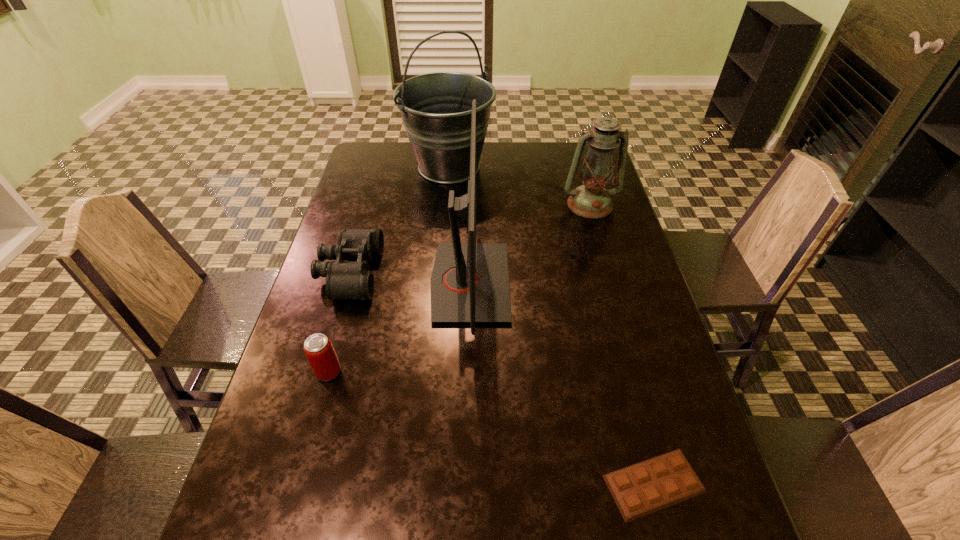
Identify which object is the nearest to the bucket. Please provide its 2D coordinates. Your answer should be formatted as a tuple, i.e. [(x, y)], where the tuple contains the x and y coordinates of a point satisfying the conditions above.

[(470, 281)]

This screenshot has height=540, width=960. Find the location of `object that is the closest to the third tallest object`. object that is the closest to the third tallest object is located at coordinates (470, 281).

Identify the location of vacant space that satisfies the following two spatial constraints: 1. on the front side of the oil lamp; 2. at the eyepieces of the second shortest object. (610, 273).

Find the location of a particular element. vacant space that satisfies the following two spatial constraints: 1. at the eyepieces of the beer can; 2. on the right side of the fifth tallest object is located at coordinates (322, 372).

Identify the location of free point that satisfies the following two spatial constraints: 1. on the front side of the oil lamp; 2. on the left side of the bucket. Image resolution: width=960 pixels, height=540 pixels. (445, 205).

Find the location of a particular element. free space that satisfies the following two spatial constraints: 1. on the back side of the shortest object; 2. on the right side of the third tallest object is located at coordinates (581, 205).

Find the location of a particular element. vacant space that satisfies the following two spatial constraints: 1. on the screen side of the chocolate bar; 2. on the right side of the monitor is located at coordinates (466, 484).

This screenshot has width=960, height=540. I want to click on vacant area that satisfies the following two spatial constraints: 1. on the front side of the bucket; 2. at the eyepieces of the fifth tallest object, so click(440, 273).

Image resolution: width=960 pixels, height=540 pixels. In order to click on free location that satisfies the following two spatial constraints: 1. on the screen side of the monitor; 2. on the right side of the shortest object in this screenshot , I will do `click(466, 484)`.

The image size is (960, 540). I want to click on blank space that satisfies the following two spatial constraints: 1. at the eyepieces of the fifth tallest object; 2. on the right side of the beer can, so click(322, 372).